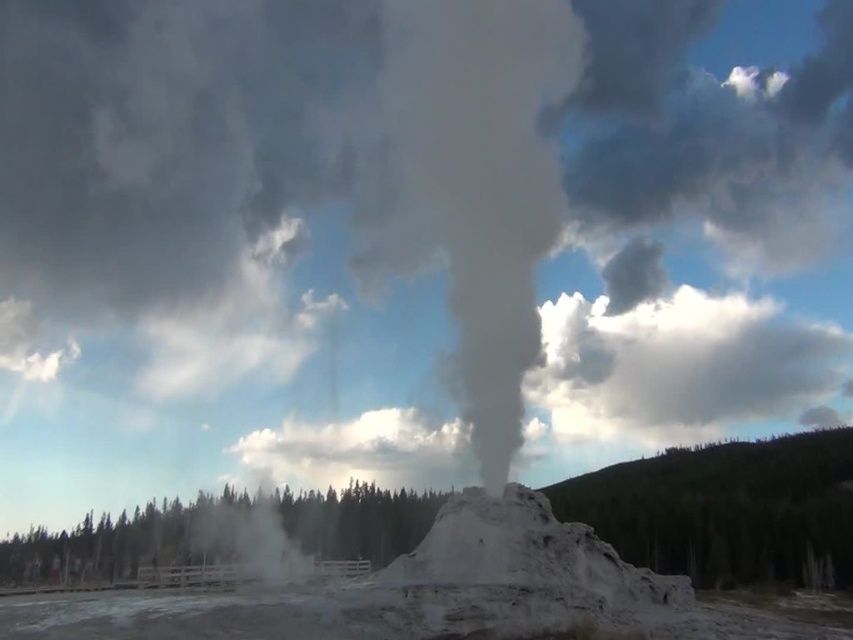
Which is below, white smoke at center or gray/cloudy smoke at center?

white smoke at center is lower down.

Is white smoke at center closer to camera compared to gray/cloudy smoke at center?

No.

Who is more forward, (442,195) or (572,88)?

Positioned in front is point (442,195).

The height and width of the screenshot is (640, 853). In order to click on white smoke at center in this screenshot , I will do `click(419, 225)`.

Is gray/cloudy smoke at center smaller than green wood trees at lower center?

Actually, gray/cloudy smoke at center might be larger than green wood trees at lower center.

Does point (515, 58) come farther from viewer compared to point (216, 513)?

Yes, point (515, 58) is farther from viewer.

The width and height of the screenshot is (853, 640). Identify the location of gray/cloudy smoke at center. (477, 182).

Does white smoke at center appear on the right side of green wood trees at lower center?

A: Indeed, white smoke at center is positioned on the right side of green wood trees at lower center.

The height and width of the screenshot is (640, 853). Identify the location of white smoke at center. (419, 225).